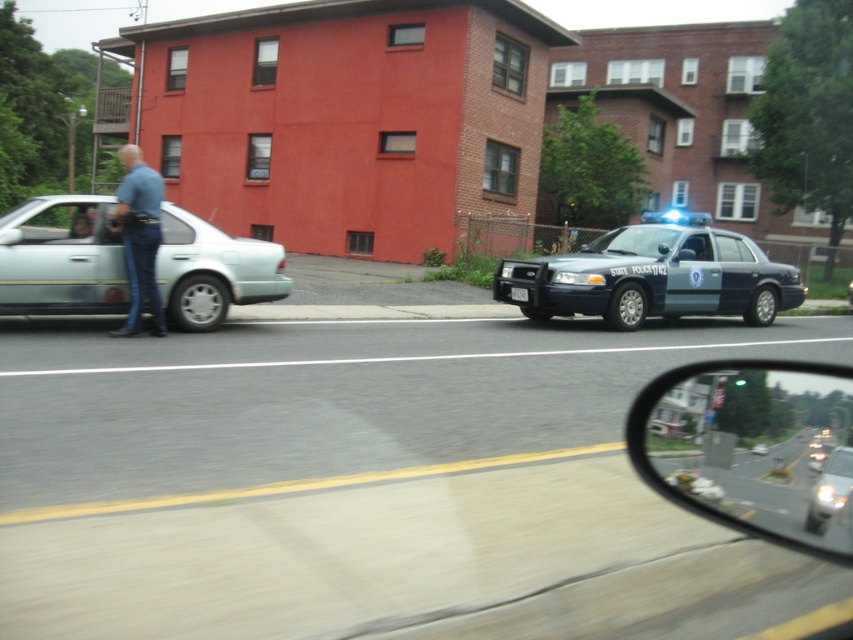
You are a pedestrian standing on the sidewalk across the street from the scene. You see the blue denim jeans at left and the white plastic license plate at center. Which object is closer to the left edge of the image?

The blue denim jeans at left is positioned on the left side of the white plastic license plate at center, so it is closer to the left edge of the image.

You are a driver who needs to park your car between the silver metallic sedan at left and the metallic blue police car at right. Your car is 4.5 meters long. Can you fit your car in the available space between them?

The silver metallic sedan at left is shorter than the metallic blue police car at right. Therefore, the space between them may vary depending on their exact positions. However, since the question does not provide specific distance measurements between the two cars, it is impossible to determine if your 4.5 meter car will fit. Additional information about the distance between the two vehicles is required to answer accurately.

In the scene shown: You are a pedestrian standing at the crosswalk. You see the silver metallic sedan at left and the metallic blue police car at right. Which vehicle is closer to the crosswalk?

The silver metallic sedan at left is closer to the crosswalk because it is positioned in front of the metallic blue police car at right, meaning it is nearer to the observer standing at the crosswalk.